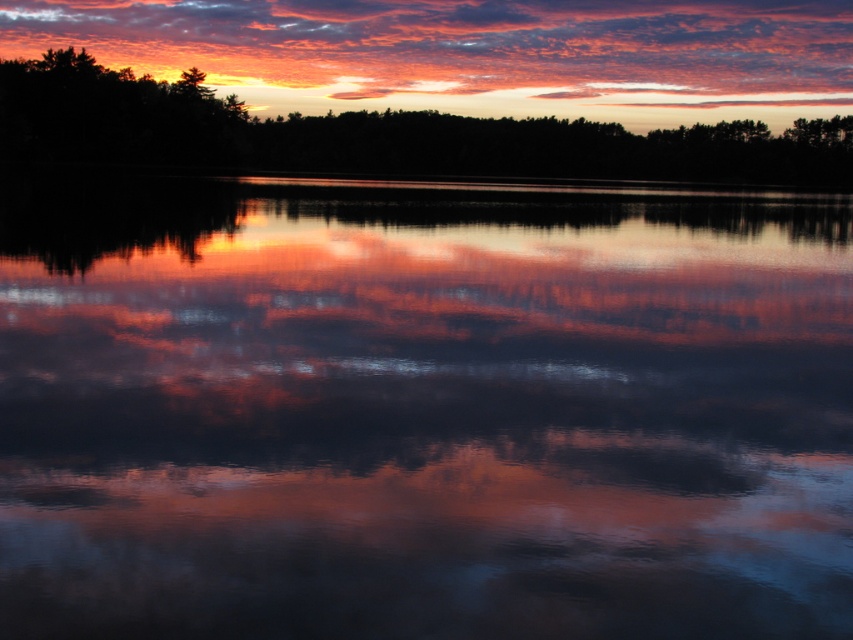
You are a bird flying at an altitude of 200 meters. You see the reflective water at center and the matte orange cloud at upper center. Can you safely descend to the water surface without colliding with the cloud?

The distance between the reflective water at center and the matte orange cloud at upper center is 221.44 meters. Since you are flying at 200 meters, you are already below the cloud, so descending to the water surface would not cause a collision with the cloud.

You are an artist trying to paint the sunset scene. You want to place the reflective water at center and the matte orange cloud at upper center accurately. Based on the scene, which object is positioned to the left of the other?

The reflective water at center is to the left of the matte orange cloud at upper center.

Looking at this image, you are standing in front of the sunset scene. There are two points marked in the image, one at coordinate point (838, 8) and another at point (421, 122). Which point is closer to your eyes?

Point (421, 122) is closer to your eyes because it is less further to the camera than point (838, 8).